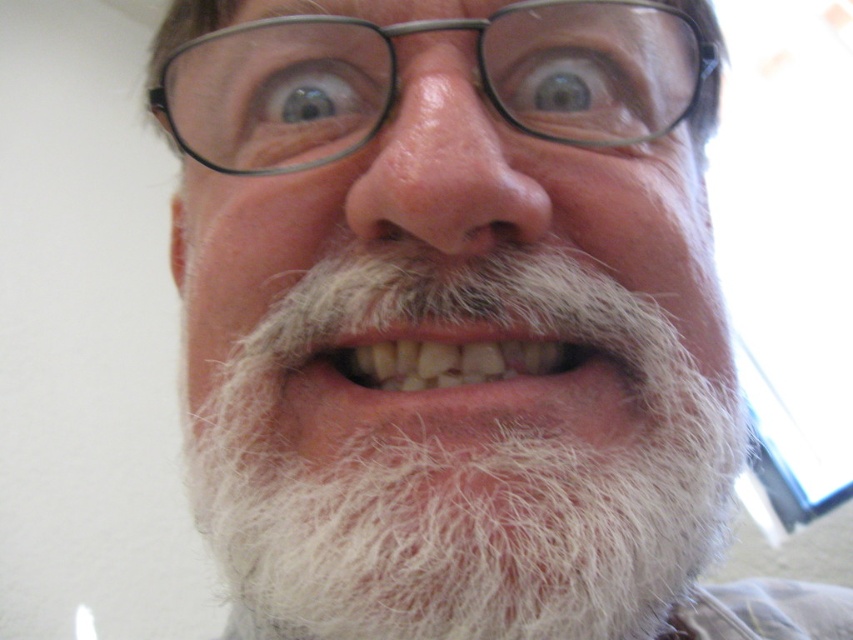
You are a dentist examining a patient. You need to check the patient for any cavities. Which object is located above the other, the white fuzzy beard at center or the natural white teeth at center?

The natural white teeth at center are positioned above the white fuzzy beard at center, so you should focus on examining the natural white teeth at center first.

You are a photographer adjusting the focus of your camera. The subject has a white fuzzy beard at center. Where should you position the focus point to ensure the beard is in sharp focus?

The white fuzzy beard at center is located at point (465, 464), so you should position the focus point at those coordinates to ensure the beard is in sharp focus.

You are a photographer adjusting the focus on your camera. You want to capture a clear image of both the white fuzzy beard at center and the black plastic glasses at upper center. Which object should you focus on first to ensure both are in focus?

You should focus on the white fuzzy beard at center first because it is closer to the viewer than the black plastic glasses at upper center, allowing the depth of field to cover both objects.